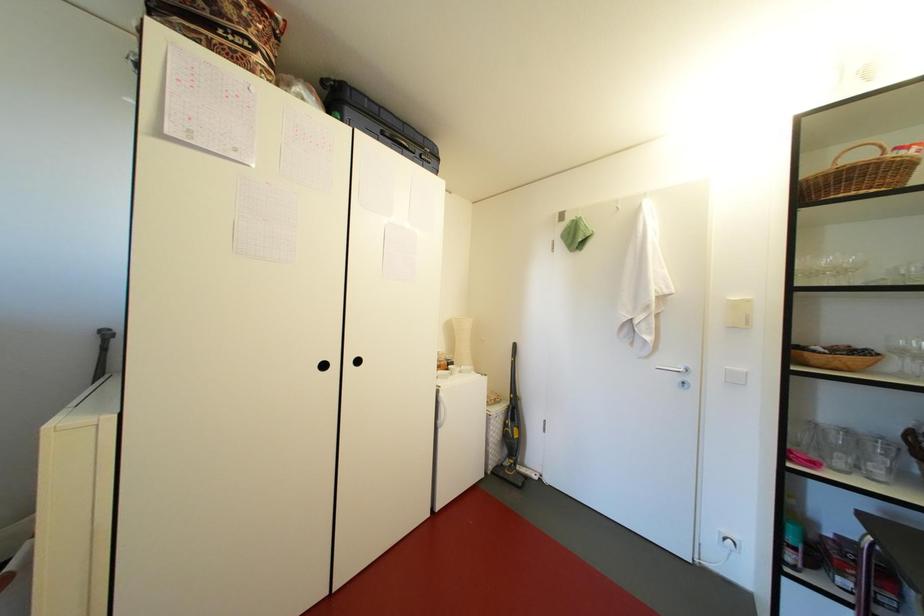
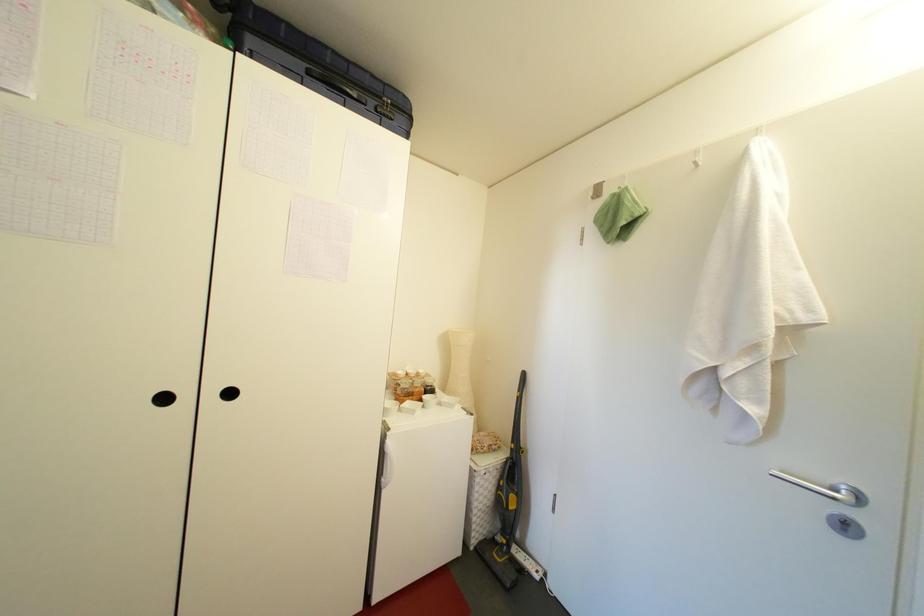
In a continuous first-person perspective shot, in which direction is the camera moving?

The cameraman walked toward right, forward.